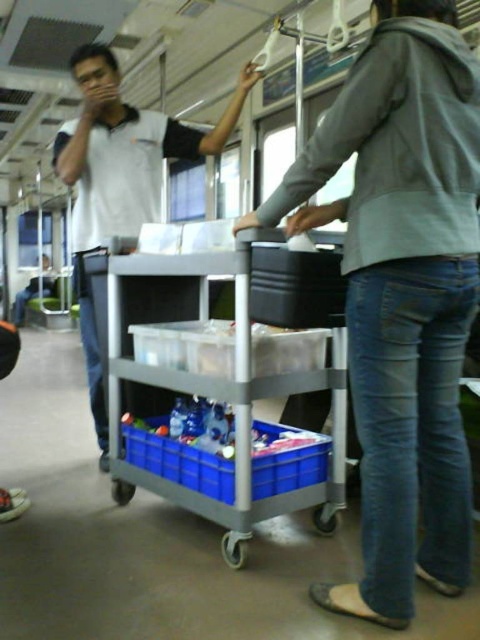
You are a passenger on a train and need to place a small bag. You see the gray plastic trolley at center and the white matte shirt at upper left. Which object can you place the bag on top of?

The gray plastic trolley at center is not as tall as white matte shirt at upper left, so the bag can be placed on top of the gray plastic trolley at center.

You are a passenger on a train and want to reach the white matte shirt at upper left without moving the gray plastic trolley at center. Is the shirt within your immediate reach?

The gray plastic trolley at center is closer to the viewer than the white matte shirt at upper left, so the shirt is further away and not within immediate reach without moving the trolley.